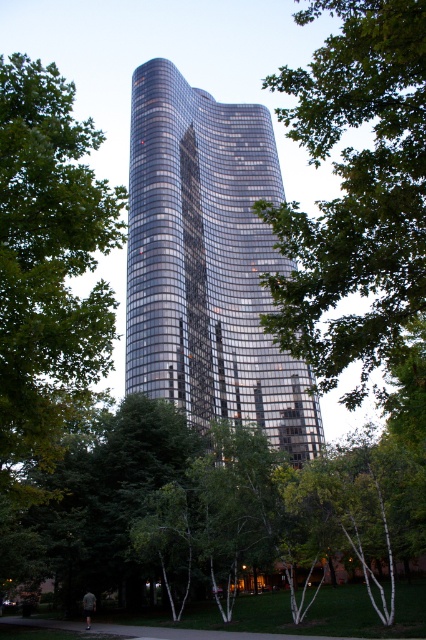
The image size is (426, 640). What do you see at coordinates (356, 193) in the screenshot?
I see `green leafy tree at center` at bounding box center [356, 193].

Is green leafy tree at center to the left of green leafy tree at left from the viewer's perspective?

Incorrect, green leafy tree at center is not on the left side of green leafy tree at left.

Image resolution: width=426 pixels, height=640 pixels. In order to click on green leafy tree at center in this screenshot , I will do `click(356, 193)`.

I want to click on green leafy tree at center, so pos(356,193).

Does glossy glass tower at center lie in front of green leafy tree at left?

No, it is not.

Is glossy glass tower at center thinner than green leafy tree at left?

In fact, glossy glass tower at center might be wider than green leafy tree at left.

Where is `glossy glass tower at center`? glossy glass tower at center is located at coordinates (207, 262).

Where is `glossy glass tower at center`? The height and width of the screenshot is (640, 426). glossy glass tower at center is located at coordinates (207, 262).

Does glossy glass tower at center appear over green leafy tree at center?

No.

Which of these two, glossy glass tower at center or green leafy tree at center, stands shorter?

Standing shorter between the two is glossy glass tower at center.

This screenshot has height=640, width=426. Find the location of `glossy glass tower at center`. glossy glass tower at center is located at coordinates (207, 262).

What are the coordinates of `glossy glass tower at center` in the screenshot? It's located at (207, 262).